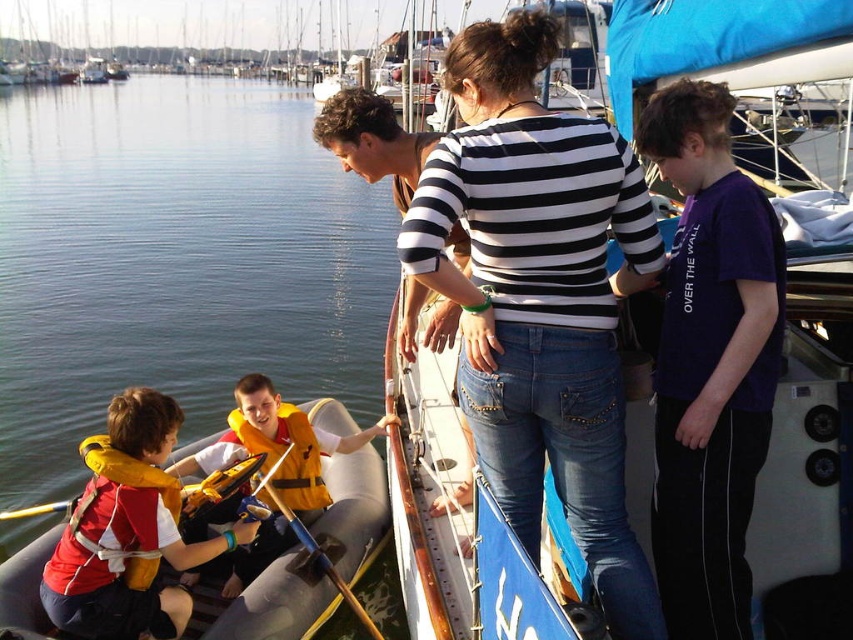
Question: Can you confirm if purple cotton shirt at upper right is positioned above yellow life jacket at center?

Choices:
 (A) yes
 (B) no

Answer: (A)

Question: Among these objects, which one is farthest from the camera?

Choices:
 (A) black and white striped shirt at center
 (B) yellow life vest at left
 (C) yellow life jacket at lower left
 (D) purple cotton shirt at upper right

Answer: (B)

Question: Can you confirm if purple cotton shirt at upper right is thinner than yellow life jacket at center?

Choices:
 (A) yes
 (B) no

Answer: (A)

Question: Which point is farther from the camera taking this photo?

Choices:
 (A) (355, 428)
 (B) (294, 483)

Answer: (A)

Question: Is the position of purple cotton shirt at upper right less distant than that of yellow life jacket at lower left?

Choices:
 (A) yes
 (B) no

Answer: (A)

Question: Among these objects, which one is farthest from the camera?

Choices:
 (A) black and white striped shirt at center
 (B) yellow life jacket at center
 (C) yellow life jacket at lower left
 (D) purple cotton shirt at upper right

Answer: (B)